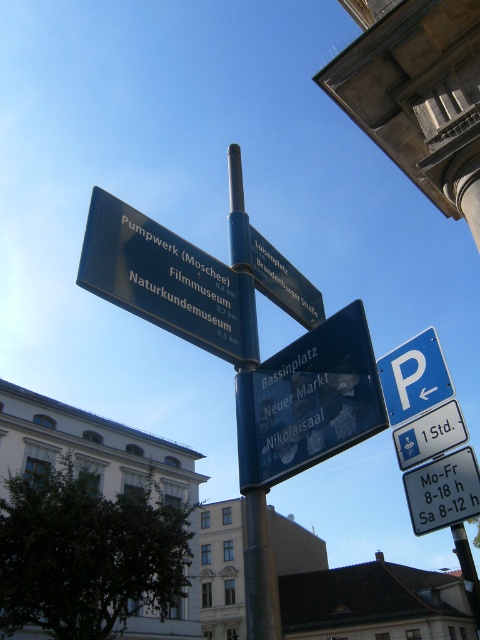
Question: Is blue plastic parking sign at upper right above black plastic street sign at center?

Choices:
 (A) no
 (B) yes

Answer: (A)

Question: Which point is farther from the camera taking this photo?

Choices:
 (A) (218, 289)
 (B) (419, 342)

Answer: (B)

Question: Which of the following is the closest to the observer?

Choices:
 (A) black plastic street sign at center
 (B) blue metallic pole at center
 (C) blue plastic parking sign at upper right
 (D) green plastic sign at upper left

Answer: (D)

Question: From the image, what is the correct spatial relationship of transparent plastic sign at center in relation to black plastic street sign at center?

Choices:
 (A) right
 (B) left

Answer: (B)

Question: Which object appears farthest from the camera in this image?

Choices:
 (A) black plastic street sign at center
 (B) transparent plastic sign at center
 (C) green plastic sign at upper left
 (D) blue metallic pole at center

Answer: (A)

Question: Can you confirm if blue metallic pole at center is positioned to the left of black plastic street sign at center?

Choices:
 (A) yes
 (B) no

Answer: (A)